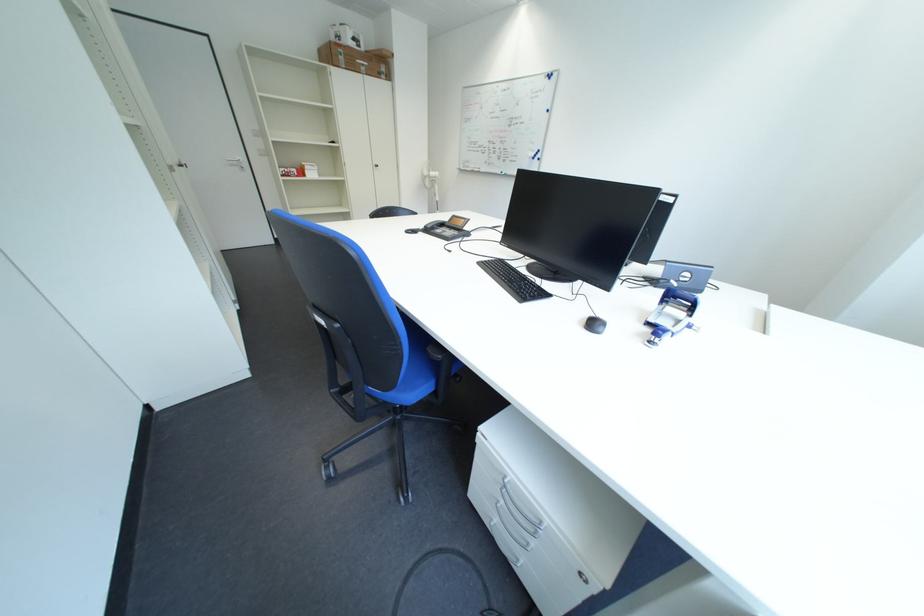
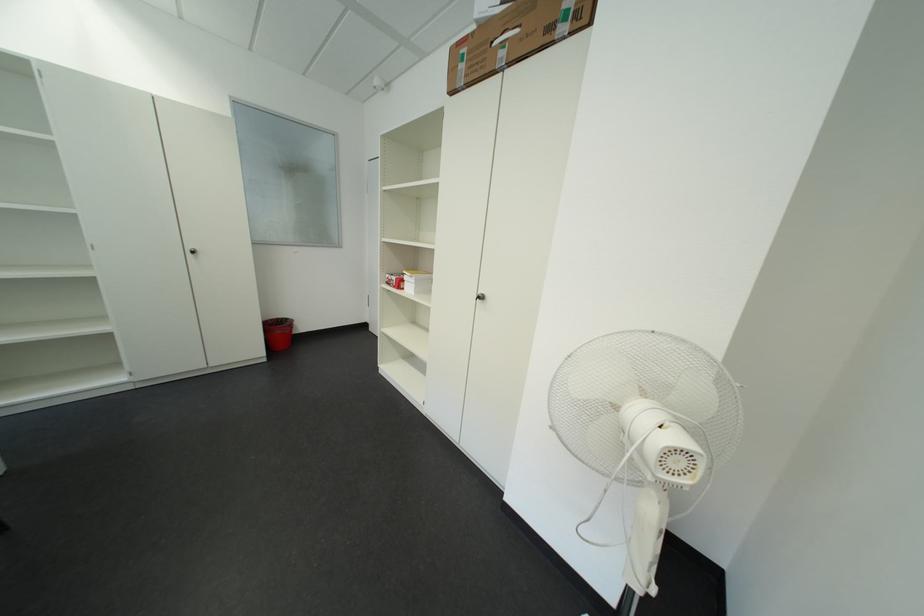
The point at (314, 176) is marked in the first image. Where is the corresponding point in the second image?

(411, 286)